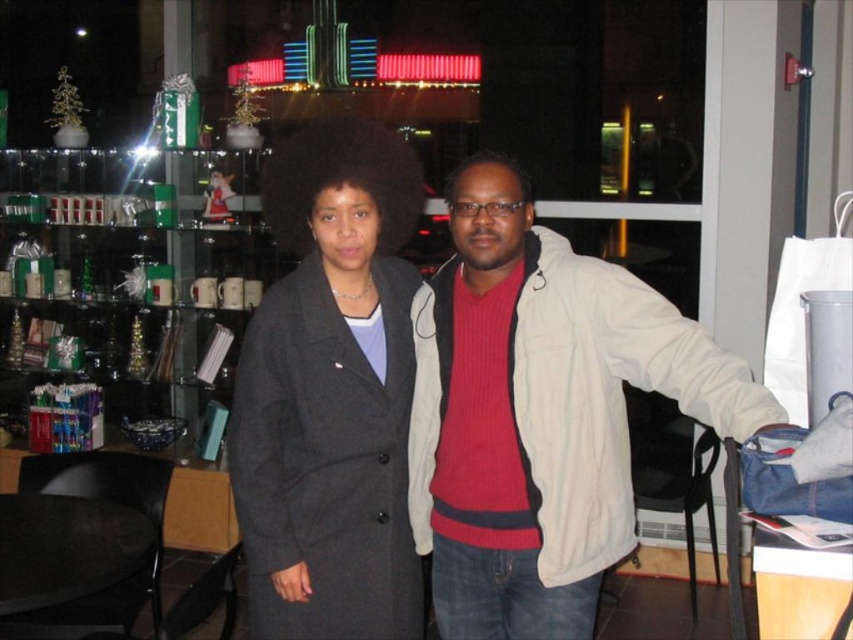
Question: Is matte beige jacket at center thinner than matte gray coat at center?

Choices:
 (A) yes
 (B) no

Answer: (B)

Question: Is matte beige jacket at center to the right of matte gray coat at center from the viewer's perspective?

Choices:
 (A) yes
 (B) no

Answer: (A)

Question: Which point is farther to the camera?

Choices:
 (A) (345, 500)
 (B) (700, 364)

Answer: (A)

Question: Considering the relative positions of matte beige jacket at center and matte gray coat at center in the image provided, where is matte beige jacket at center located with respect to matte gray coat at center?

Choices:
 (A) right
 (B) left

Answer: (A)